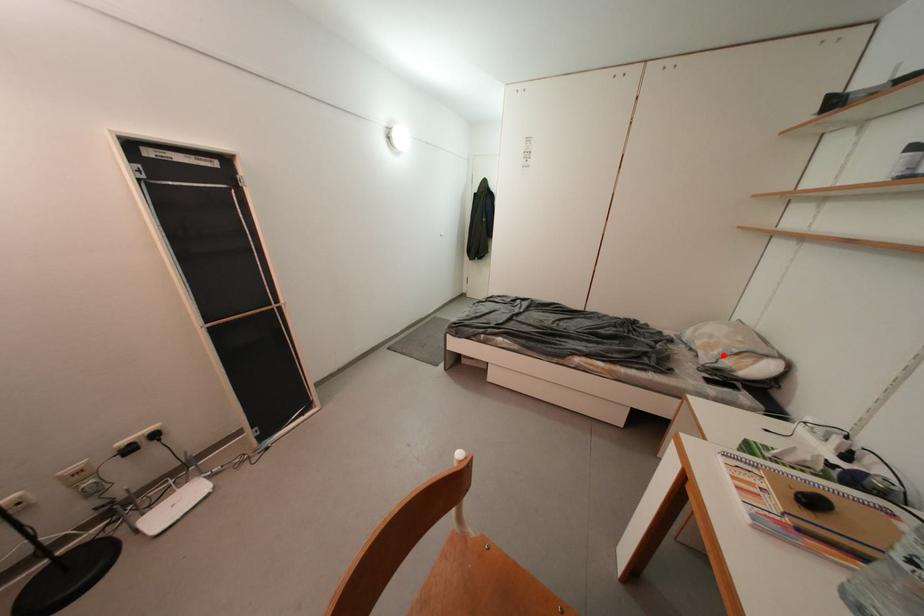
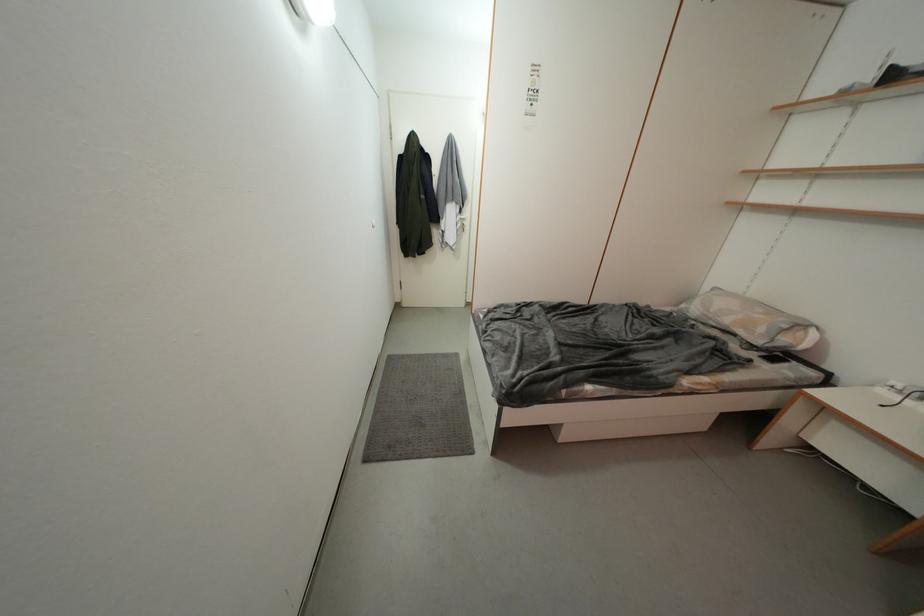
In the second image, find the point that corresponds to the highlighted location in the first image.

(769, 333)